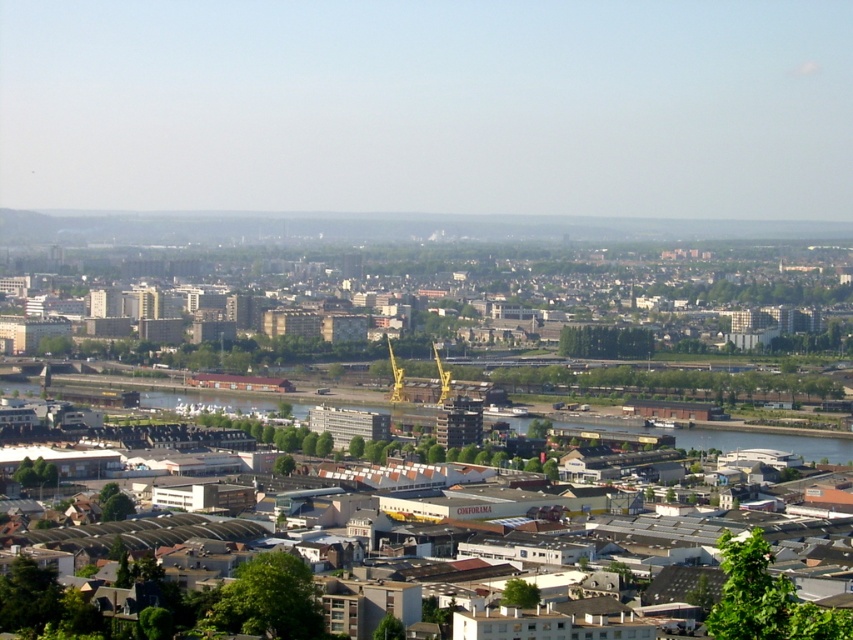
Question: Is the position of brown brick buildings at center more distant than that of green concrete waterway at lower center?

Choices:
 (A) yes
 (B) no

Answer: (B)

Question: Does gray concrete buildings at center appear on the right side of green concrete waterway at lower center?

Choices:
 (A) yes
 (B) no

Answer: (B)

Question: Which point is closer to the camera?

Choices:
 (A) gray concrete buildings at center
 (B) brown brick buildings at center
 (C) green concrete waterway at lower center

Answer: (A)

Question: Considering the real-world distances, which object is farthest from the green concrete waterway at lower center?

Choices:
 (A) gray concrete buildings at center
 (B) brown brick buildings at center

Answer: (B)

Question: Which of the following is the closest to the observer?

Choices:
 (A) (573, 372)
 (B) (834, 452)

Answer: (A)

Question: Considering the relative positions of gray concrete buildings at center and green concrete waterway at lower center in the image provided, where is gray concrete buildings at center located with respect to green concrete waterway at lower center?

Choices:
 (A) left
 (B) right

Answer: (A)